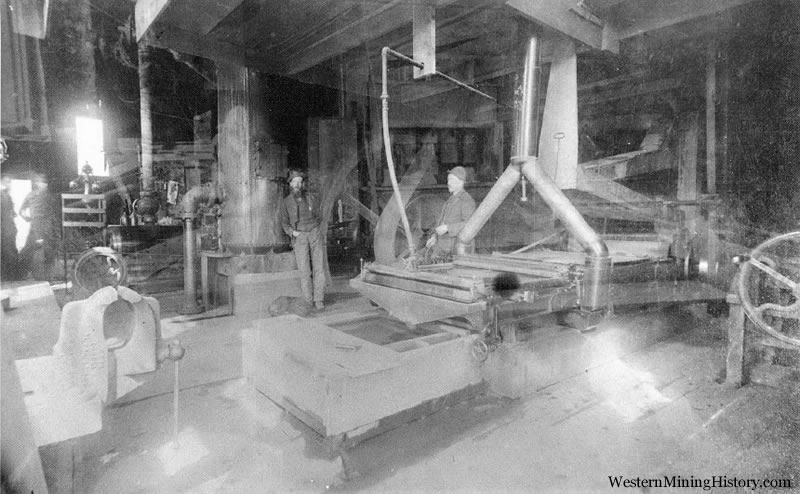
Image resolution: width=800 pixels, height=494 pixels. I want to click on floor, so coord(573,435).